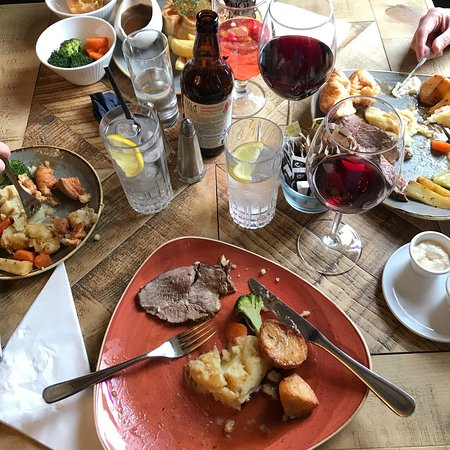
Locate an element on the screen. This screenshot has width=450, height=450. dinner plate is located at coordinates (318, 417).